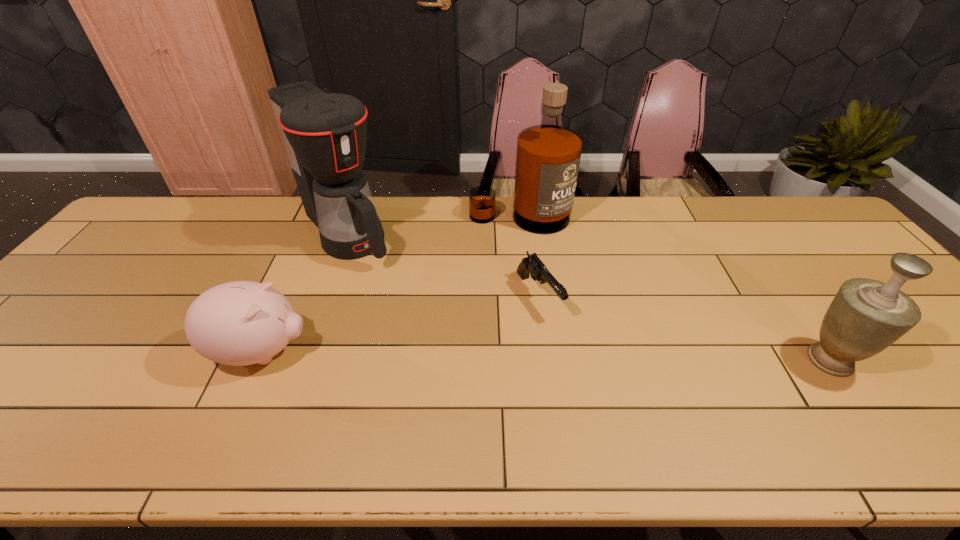
Image resolution: width=960 pixels, height=540 pixels. I want to click on vacant space on the desktop that is between the second shortest object and the third tallest object and is positioned pour from the carafe of the coffee maker, so click(464, 355).

The height and width of the screenshot is (540, 960). Find the location of `free spot on the desktop that is between the fourth tallest object and the urn and is positioned on the front label of the liquor`. free spot on the desktop that is between the fourth tallest object and the urn and is positioned on the front label of the liquor is located at coordinates (554, 356).

The width and height of the screenshot is (960, 540). I want to click on free space on the desktop that is between the second shortest object and the rightmost object and is positioned at the end of the barrel of the gun, so click(587, 356).